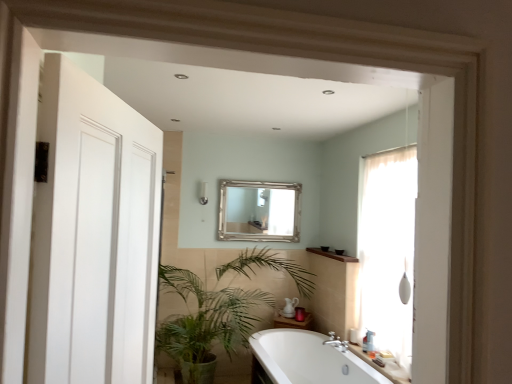
Question: Is translucent fabric curtain at right taller or shorter than white glossy counter top at lower right?

Choices:
 (A) short
 (B) tall

Answer: (B)

Question: Looking at their shapes, would you say translucent fabric curtain at right is wider or thinner than white glossy counter top at lower right?

Choices:
 (A) thin
 (B) wide

Answer: (B)

Question: Which of these objects is positioned farthest from the white glossy counter top at lower right?

Choices:
 (A) silver metallic mirror at upper center
 (B) translucent fabric curtain at right
 (C) white plastic bottle at lower right
 (D) white matte door at left
 (E) white glossy bathtub at center

Answer: (D)

Question: Which object is positioned closest to the silver metallic mirror at upper center?

Choices:
 (A) white matte door at left
 (B) white glossy counter top at lower right
 (C) white glossy bathtub at center
 (D) green leafy plant at lower left
 (E) translucent fabric curtain at right

Answer: (D)